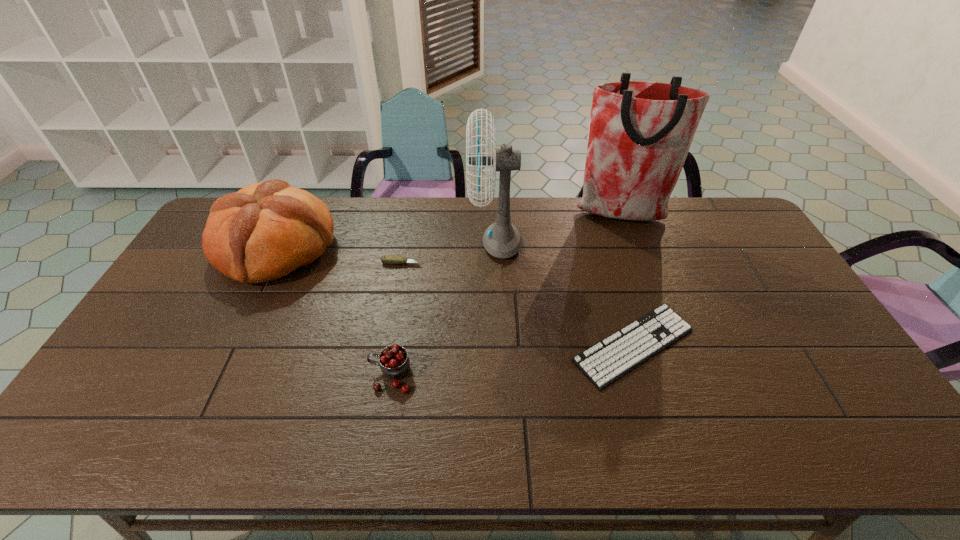
This screenshot has height=540, width=960. Identify the location of unoccupied area between the pocketknife and the fan. [x=448, y=253].

This screenshot has height=540, width=960. I want to click on vacant area that lies between the fourth object from left to right and the grocery bag, so click(557, 229).

Locate an element on the screen. This screenshot has height=540, width=960. vacant space that is in between the pocketknife and the fourth object from left to right is located at coordinates (448, 253).

The image size is (960, 540). Identify the location of vacant space that's between the second shortest object and the bread. (339, 255).

Locate an element on the screen. This screenshot has height=540, width=960. free space between the fourth tallest object and the grocery bag is located at coordinates (505, 295).

In order to click on object that is the fifth closest to the bread in this screenshot , I will do `click(640, 132)`.

Locate an element on the screen. object that stands as the second closest to the cherry is located at coordinates click(386, 259).

At what (x,y) coordinates should I click in order to perform the action: click on free point that satisfies the following two spatial constraints: 1. on the handle side of the grocery bag; 2. on the left side of the third shortest object. Please return your answer as a coordinate pair (x, y). The image size is (960, 540). Looking at the image, I should click on (418, 216).

At what (x,y) coordinates should I click in order to perform the action: click on free spot that satisfies the following two spatial constraints: 1. on the front-facing side of the third object from right to left; 2. on the left side of the shortest object. Please return your answer as a coordinate pair (x, y). Looking at the image, I should click on (499, 346).

Locate an element on the screen. This screenshot has width=960, height=540. vacant area that satisfies the following two spatial constraints: 1. on the front side of the second shortest object; 2. on the left side of the shortest object is located at coordinates (386, 346).